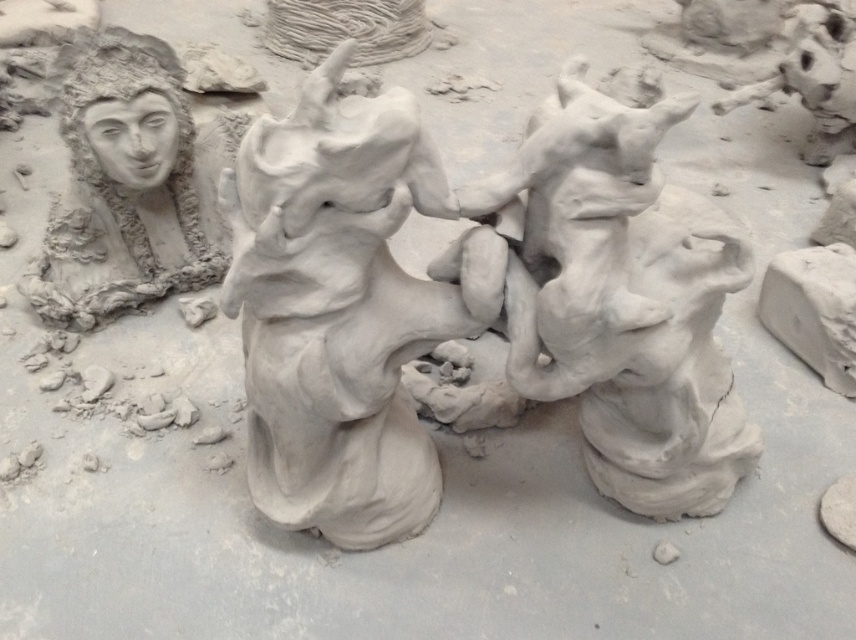
Does point (290, 458) lie behind point (143, 189)?

No.

Is clay figure at center bigger than matte clay face at upper left?

Correct, clay figure at center is larger in size than matte clay face at upper left.

Which is in front, point (373, 129) or point (241, 116)?

Point (373, 129)

Locate an element on the screen. This screenshot has width=856, height=640. clay figure at center is located at coordinates (342, 308).

Between point (268, 124) and point (587, 298), which one is positioned behind?

Point (268, 124)

Is clay figure at center above clay sculpture at center?

Indeed, clay figure at center is positioned over clay sculpture at center.

Which is behind, point (409, 490) or point (723, 236)?

The point (409, 490) is behind.

Identify the location of clay figure at center. (342, 308).

Between clay sculpture at center and matte clay face at upper left, which one is positioned lower?

clay sculpture at center is lower down.

Which is more to the left, clay sculpture at center or matte clay face at upper left?

Positioned to the left is matte clay face at upper left.

Where is `clay sculpture at center`? This screenshot has height=640, width=856. clay sculpture at center is located at coordinates (625, 304).

At what (x,y) coordinates should I click in order to perform the action: click on clay sculpture at center. Please return your answer as a coordinate pair (x, y). The height and width of the screenshot is (640, 856). Looking at the image, I should click on (625, 304).